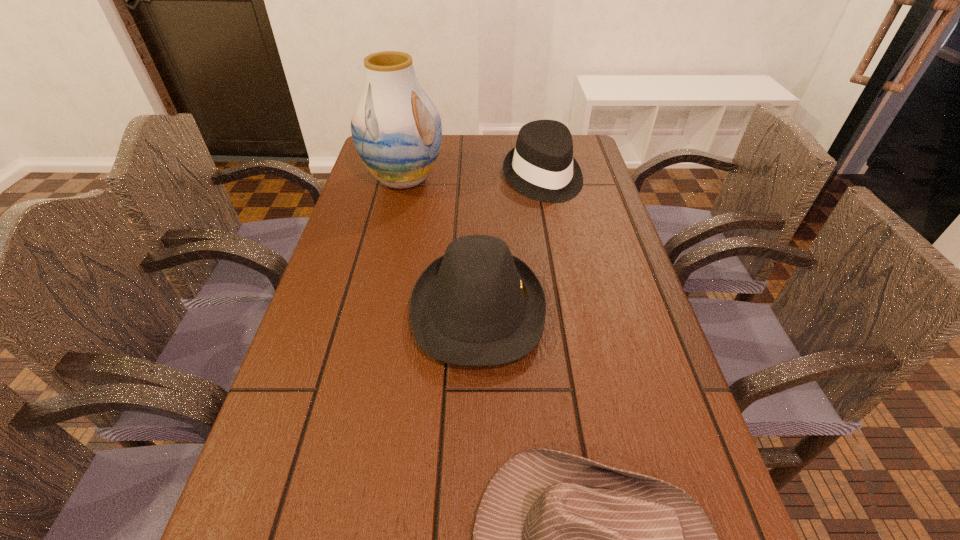
Select which fedora is the closest to the farthest fedora. Please provide its 2D coordinates. Your answer should be formatted as a tuple, i.e. [(x, y)], where the tuple contains the x and y coordinates of a point satisfying the conditions above.

[(477, 305)]

The width and height of the screenshot is (960, 540). Find the location of `free spot that satisfies the following two spatial constraints: 1. on the front side of the farthest fedora; 2. on the front-facing side of the third farthest object`. free spot that satisfies the following two spatial constraints: 1. on the front side of the farthest fedora; 2. on the front-facing side of the third farthest object is located at coordinates (568, 310).

At what (x,y) coordinates should I click in order to perform the action: click on free point that satisfies the following two spatial constraints: 1. on the front side of the farthest fedora; 2. on the front-facing side of the third farthest object. Please return your answer as a coordinate pair (x, y). Image resolution: width=960 pixels, height=540 pixels. Looking at the image, I should click on (568, 310).